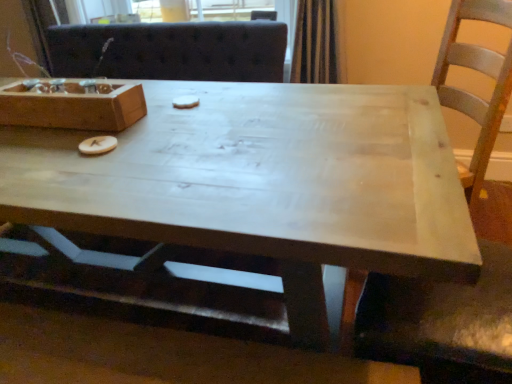
You are a GUI agent. You are given a task and a screenshot of the screen. Output one action in this format:
    pyautogui.click(x=<x>, y=<y>)
    Task: Click on the unoccupied region to the right of white matte cookie at center, which is the 2th food in left-to-right order
    This screenshot has width=512, height=384.
    Given the screenshot: What is the action you would take?
    pyautogui.click(x=232, y=106)